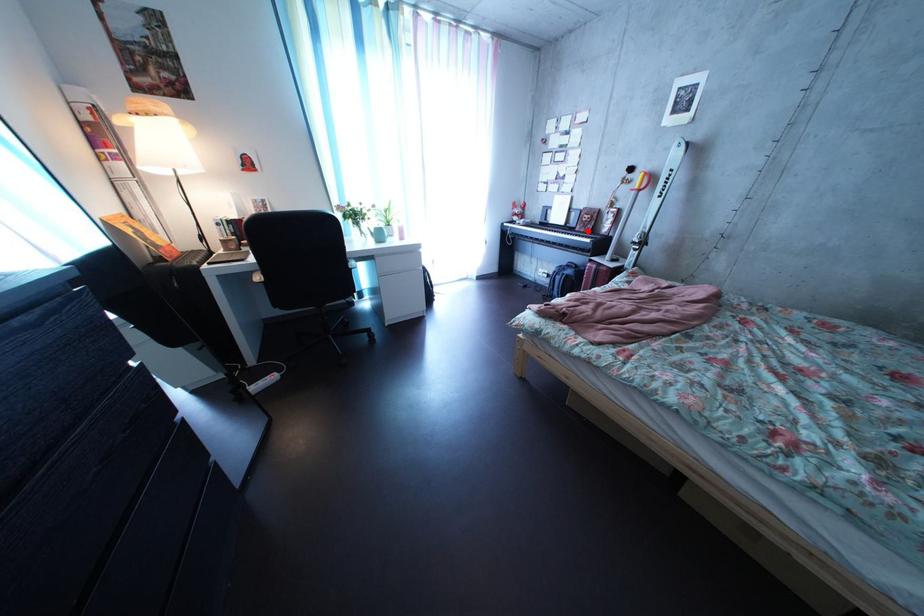
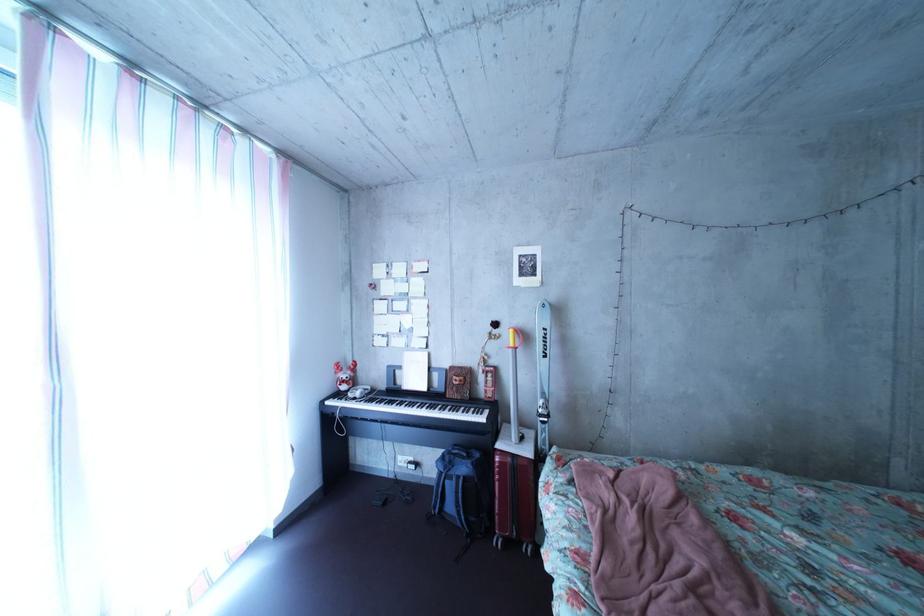
Question: I am providing you with two images of the same scene from different viewpoints. A red point is shown in image1. For the corresponding object point in image2, is it positioned nearer or farther from the camera?

Choices:
 (A) Nearer
 (B) Farther

Answer: (B)